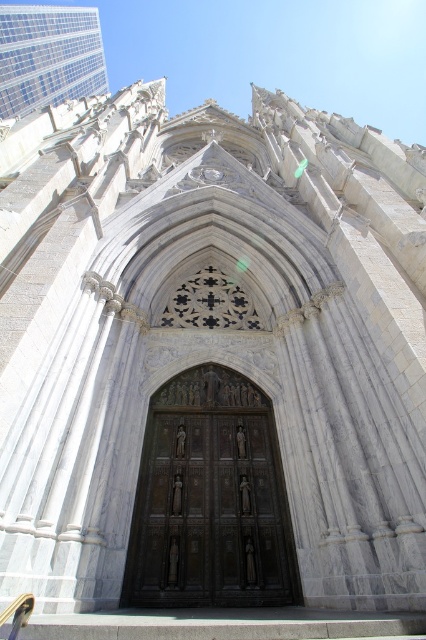
You are standing in front of the cathedral entrance and want to take a photo of both the dark brown wood at center and the matte gray stone church at upper left. Which object should you point your camera towards first to include both in your shot?

You should point your camera towards the matte gray stone church at upper left first because the dark brown wood at center is positioned under it, so adjusting the angle to include both would require framing from the top down.